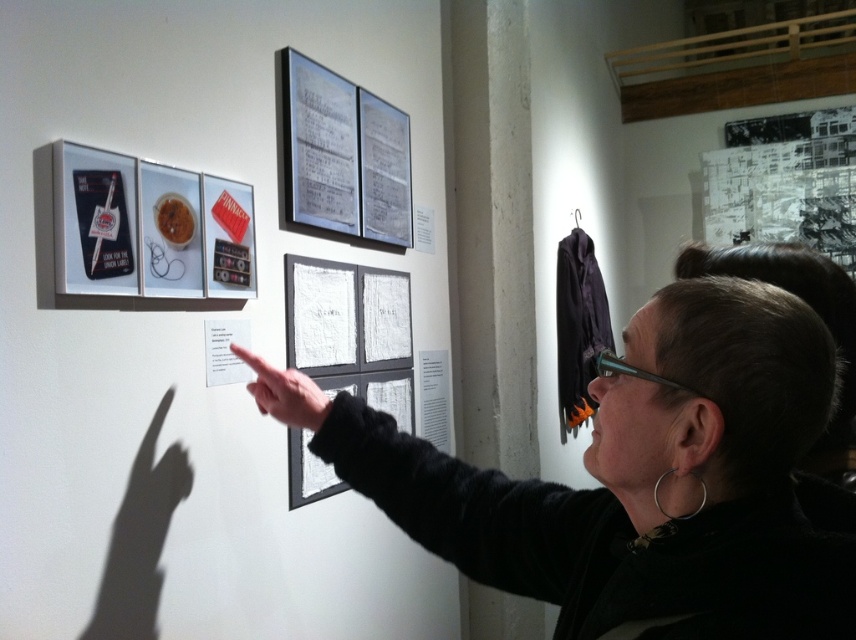
What is the point at coordinate (635, 480) located on in the image?

The point at coordinate (635, 480) is located on the black fabric at center.

You are an interior designer assessing the space in the image. You need to determine if the black fabric at center can be used to cover the transparent plastic glasses at upper center without any overlap. Based on their sizes, what would you advise?

The black fabric at center has a larger size compared to transparent plastic glasses at upper center, so it can cover them without overlap.